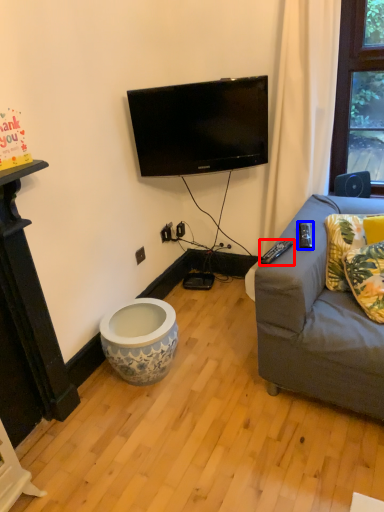
Question: Among these objects, which one is farthest to the camera, remote control (highlighted by a red box) or remote control (highlighted by a blue box)?

Choices:
 (A) remote control
 (B) remote control

Answer: (B)